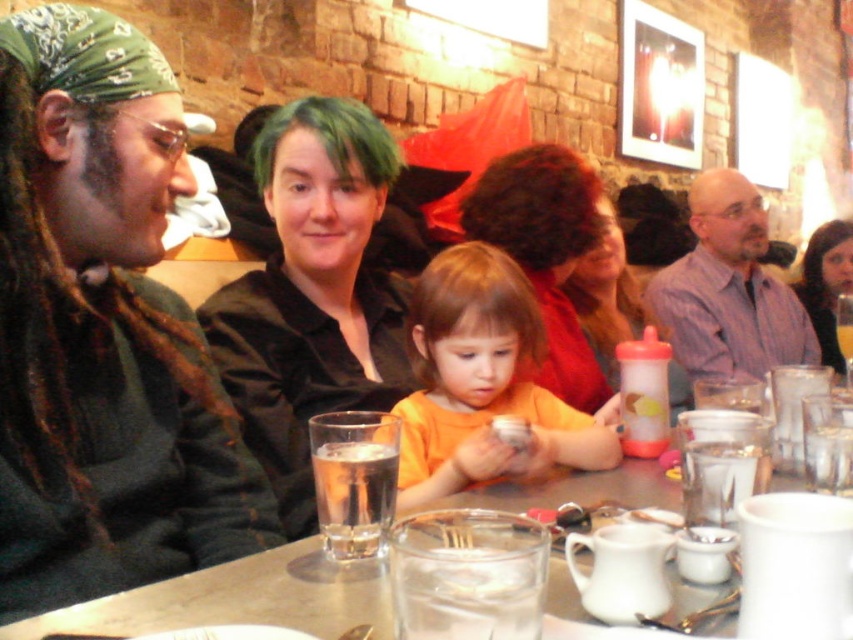
Between orange matte shirt at center and matte plastic sippy cup at center, which one has more height?

matte plastic sippy cup at center

Who is positioned more to the right, orange matte shirt at center or matte plastic sippy cup at center?

Positioned to the right is matte plastic sippy cup at center.

Does point (512, 324) come closer to viewer compared to point (606, 324)?

Yes.

This screenshot has width=853, height=640. What are the coordinates of `orange matte shirt at center` in the screenshot? It's located at (483, 381).

Who is lower down, dark curly hair at center or matte plastic sippy cup at center?

Positioned lower is matte plastic sippy cup at center.

You are a GUI agent. You are given a task and a screenshot of the screen. Output one action in this format:
    pyautogui.click(x=<x>, y=<y>)
    Task: Click on the dark curly hair at center
    Image resolution: width=853 pixels, height=640 pixels.
    Given the screenshot: What is the action you would take?
    [x=535, y=205]

This screenshot has width=853, height=640. Identify the location of dark curly hair at center. (535, 205).

This screenshot has height=640, width=853. Find the location of `dark curly hair at center`. dark curly hair at center is located at coordinates (535, 205).

Is black satin shirt at center thinner than clear glass table at center?

Yes, black satin shirt at center is thinner than clear glass table at center.

Which is above, black satin shirt at center or clear glass table at center?

black satin shirt at center is higher up.

Does point (241, 289) come in front of point (320, 568)?

No, (241, 289) is further to viewer.

Locate an element on the screen. The height and width of the screenshot is (640, 853). black satin shirt at center is located at coordinates (312, 294).